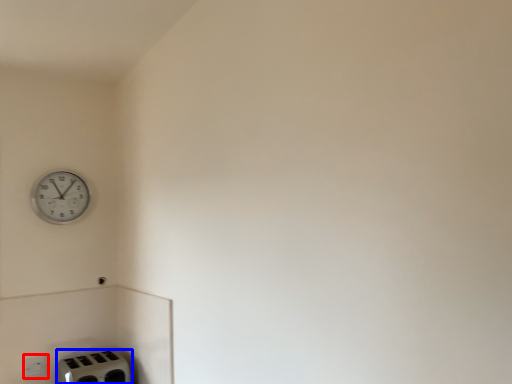
Question: Which point is closer to the camera, electric outlet (highlighted by a red box) or appliance (highlighted by a blue box)?

Choices:
 (A) electric outlet
 (B) appliance

Answer: (B)